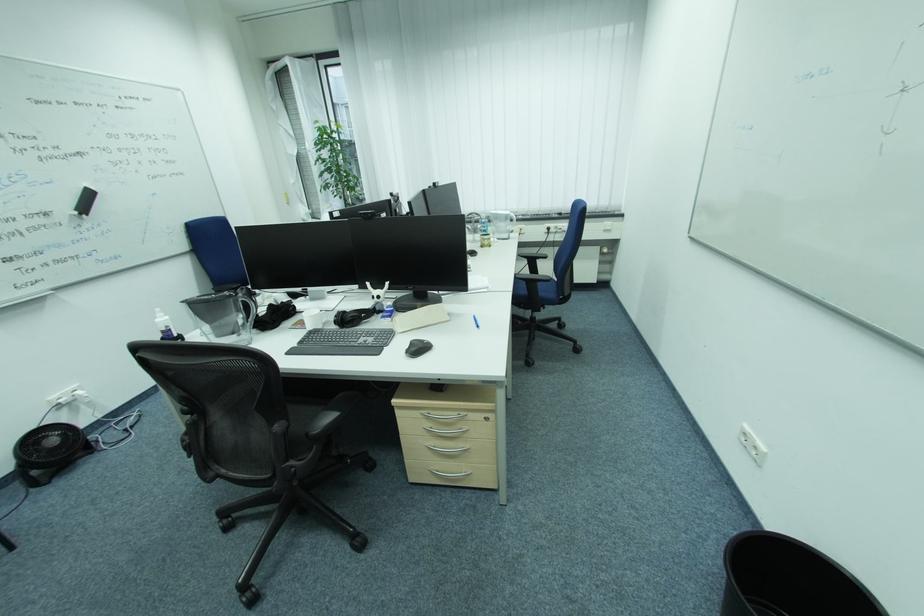
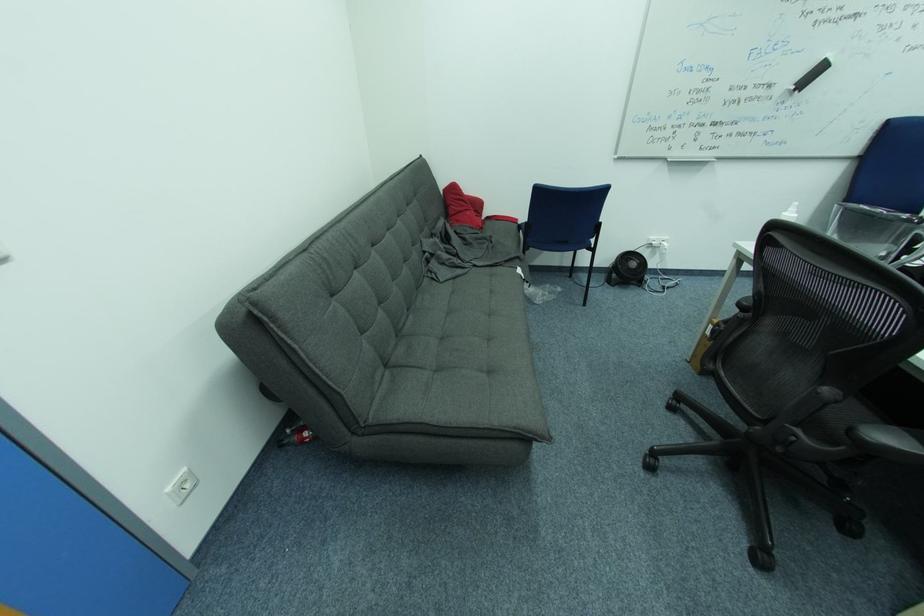
In the second image, find the point that corresponds to (x=164, y=321) in the first image.

(792, 215)